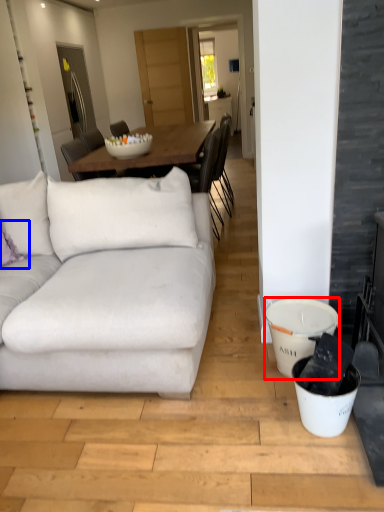
Question: Which object is further to the camera taking this photo, bucket (highlighted by a red box) or pillow (highlighted by a blue box)?

Choices:
 (A) bucket
 (B) pillow

Answer: (B)